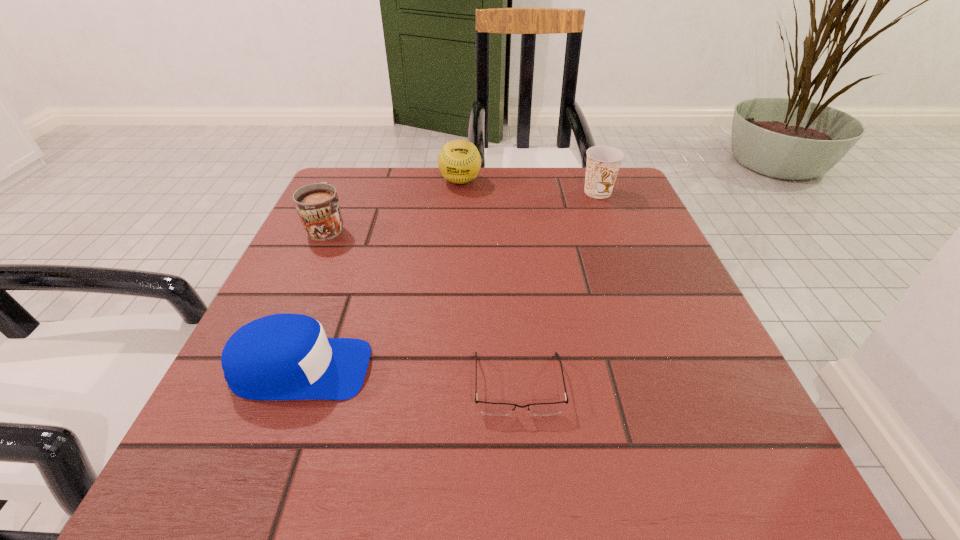
This screenshot has width=960, height=540. Find the location of `free spot located 0.260m on the front-facing side of the baseball cap`. free spot located 0.260m on the front-facing side of the baseball cap is located at coordinates (538, 369).

Where is `free space located 0.060m on the front-facing side of the spectacles`? free space located 0.060m on the front-facing side of the spectacles is located at coordinates coord(524,460).

This screenshot has width=960, height=540. Find the location of `softball situated at the far edge`. softball situated at the far edge is located at coordinates (459, 161).

This screenshot has height=540, width=960. What are the coordinates of `Dixie cup that is at the far edge` in the screenshot? It's located at (603, 162).

At what (x,y) coordinates should I click in order to perform the action: click on mug that is at the far edge. Please return your answer as a coordinate pair (x, y). The image size is (960, 540). Looking at the image, I should click on (317, 205).

The image size is (960, 540). Identify the location of mug positioned at the left edge. (317, 205).

Find the location of `baseball cap that is positioned at the left edge`. baseball cap that is positioned at the left edge is located at coordinates (286, 356).

The height and width of the screenshot is (540, 960). I want to click on object that is at the right edge, so click(603, 162).

Where is `object located at the far left corner`? object located at the far left corner is located at coordinates (317, 205).

Find the location of a particular element. The width and height of the screenshot is (960, 540). object situated at the far right corner is located at coordinates (603, 162).